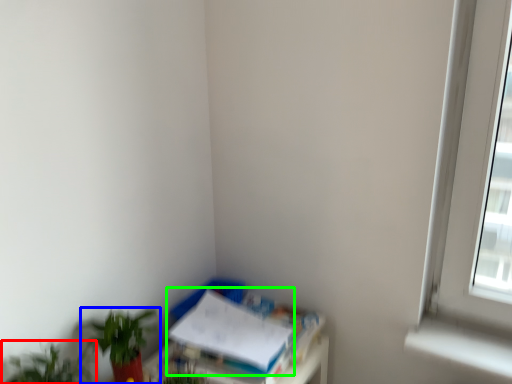
Question: Which object is the closest to the houseplant (highlighted by a red box)? Choose among these: houseplant (highlighted by a blue box) or paperback book (highlighted by a green box).

Choices:
 (A) houseplant
 (B) paperback book

Answer: (A)